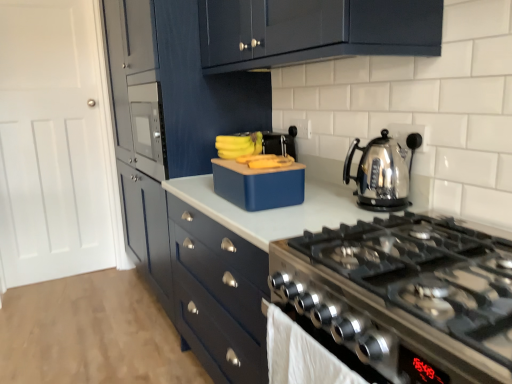
Question: In terms of width, does matte blue cabinets at center, the 2th cabinetry in the front-to-back sequence, look wider or thinner when compared to white glossy countertop at center?

Choices:
 (A) thin
 (B) wide

Answer: (B)

Question: Is point (112, 41) closer or farther from the camera than point (282, 228)?

Choices:
 (A) closer
 (B) farther

Answer: (B)

Question: Which object is the farthest from the stainless steel gas stove at lower right?

Choices:
 (A) stainless steel kettle at right
 (B) white glossy countertop at center
 (C) white cotton towel at lower center
 (D) blue matte lunchbox at center
 (E) matte blue cabinets at center, the 2th cabinetry in the front-to-back sequence

Answer: (E)

Question: Considering the real-world distances, which object is farthest from the white glossy countertop at center?

Choices:
 (A) matte blue cabinets at center, which is the first cabinetry in back-to-front order
 (B) stainless steel kettle at right
 (C) blue matte lunchbox at center
 (D) light brown wood floor at lower left
 (E) glossy dark blue cabinet at upper center, which is counted as the first cabinetry, starting from the front

Answer: (D)